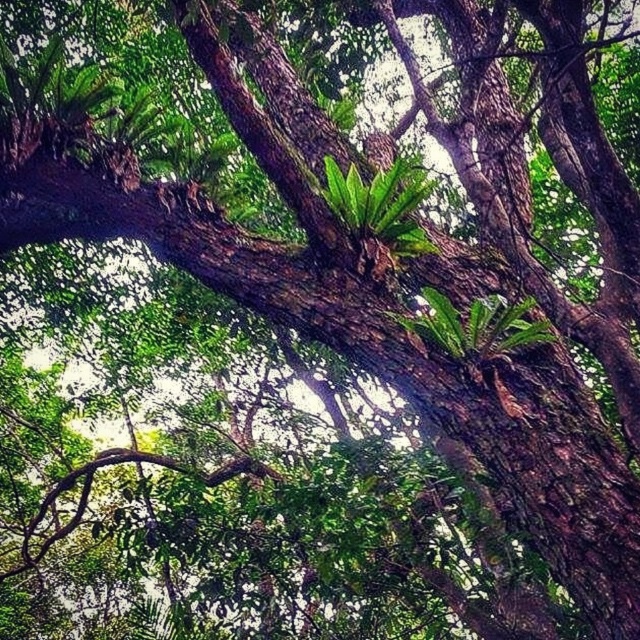
Question: Which of the following is the farthest from the observer?

Choices:
 (A) (394, 211)
 (B) (449, 340)

Answer: (A)

Question: Does green leafy fern at upper center have a lesser width compared to green leafy fern at center?

Choices:
 (A) no
 (B) yes

Answer: (B)

Question: Is green leafy fern at upper center positioned in front of green leafy fern at center?

Choices:
 (A) yes
 (B) no

Answer: (B)

Question: Which object appears farthest from the camera in this image?

Choices:
 (A) green leafy fern at center
 (B) green leafy fern at upper center

Answer: (B)

Question: Which object is closer to the camera taking this photo?

Choices:
 (A) green leafy fern at upper center
 (B) green leafy fern at center

Answer: (B)

Question: Considering the relative positions of green leafy fern at upper center and green leafy fern at center in the image provided, where is green leafy fern at upper center located with respect to green leafy fern at center?

Choices:
 (A) above
 (B) below

Answer: (A)